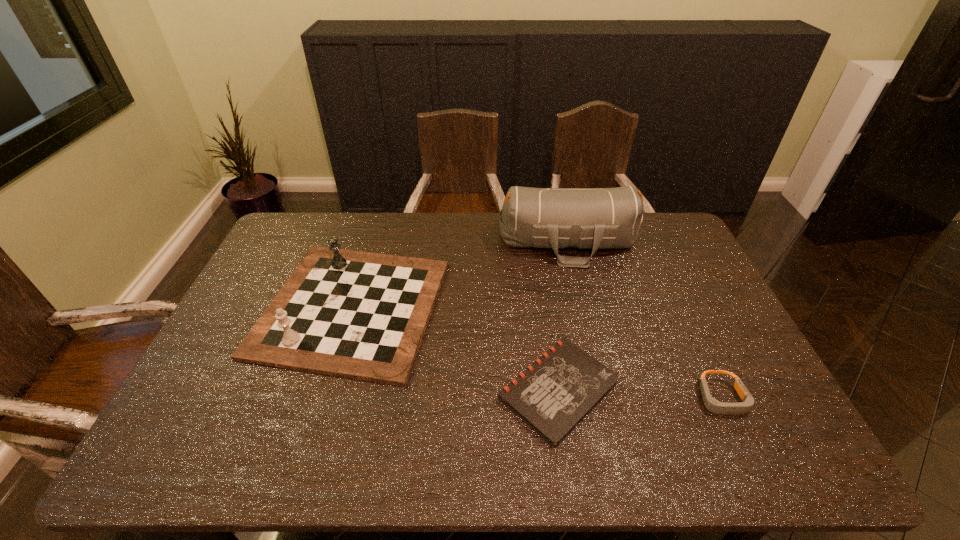
This screenshot has height=540, width=960. In order to click on vacant space that satisfies the following two spatial constraints: 1. on the back side of the leftmost object; 2. on the left side of the tallest object in this screenshot , I will do `click(372, 242)`.